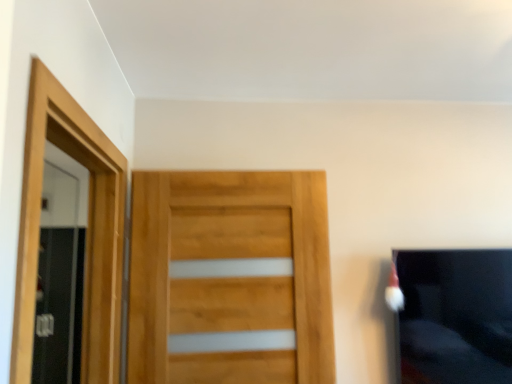
Question: Is black fabric couch at right closer to camera compared to natural wood door at center?

Choices:
 (A) yes
 (B) no

Answer: (B)

Question: Does black fabric couch at right have a lesser height compared to natural wood door at center?

Choices:
 (A) no
 (B) yes

Answer: (B)

Question: From the image's perspective, is black fabric couch at right above natural wood door at center?

Choices:
 (A) yes
 (B) no

Answer: (B)

Question: Is black fabric couch at right facing towards natural wood door at center?

Choices:
 (A) no
 (B) yes

Answer: (A)

Question: Is black fabric couch at right next to natural wood door at center?

Choices:
 (A) yes
 (B) no

Answer: (B)

Question: Considering the positions of point (429, 367) and point (177, 296), is point (429, 367) closer or farther from the camera than point (177, 296)?

Choices:
 (A) farther
 (B) closer

Answer: (A)

Question: Relative to natural wood door at center, is black fabric couch at right in front or behind?

Choices:
 (A) front
 (B) behind

Answer: (B)

Question: From a real-world perspective, is black fabric couch at right positioned above or below natural wood door at center?

Choices:
 (A) below
 (B) above

Answer: (A)

Question: Considering the positions of black fabric couch at right and natural wood door at center in the image, is black fabric couch at right wider or thinner than natural wood door at center?

Choices:
 (A) wide
 (B) thin

Answer: (A)

Question: Relative to wooden screen door at left, which is the 1th screen door in back-to-front order, is black fabric couch at right in front or behind?

Choices:
 (A) front
 (B) behind

Answer: (A)

Question: From the image's perspective, relative to wooden screen door at left, the 2th screen door when ordered from right to left, is black fabric couch at right above or below?

Choices:
 (A) below
 (B) above

Answer: (B)

Question: Choose the correct answer: Is black fabric couch at right inside wooden screen door at left, the first screen door in the left-to-right sequence, or outside it?

Choices:
 (A) inside
 (B) outside

Answer: (B)

Question: In terms of height, does black fabric couch at right look taller or shorter compared to wooden screen door at left, which is the 1th screen door in back-to-front order?

Choices:
 (A) short
 (B) tall

Answer: (A)

Question: In the image, is wooden screen door at left, which is the 1th screen door in back-to-front order, on the left side or the right side of black fabric couch at right?

Choices:
 (A) left
 (B) right

Answer: (A)

Question: From their relative heights in the image, would you say wooden screen door at left, which is the 1th screen door in back-to-front order, is taller or shorter than black fabric couch at right?

Choices:
 (A) short
 (B) tall

Answer: (B)